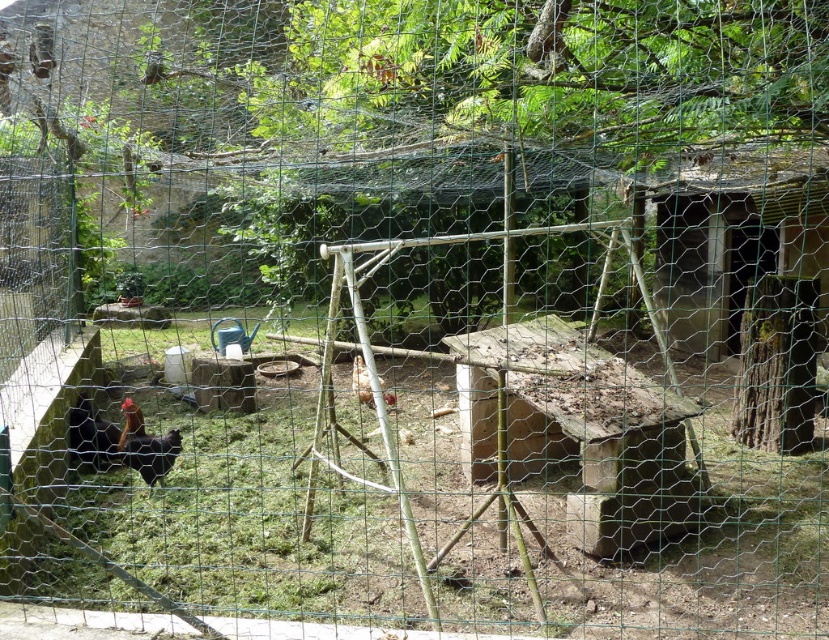
Can you confirm if black matte chicken at lower left is positioned to the right of brown matte chicken at center?

In fact, black matte chicken at lower left is to the left of brown matte chicken at center.

Where is `black matte chicken at lower left`? The width and height of the screenshot is (829, 640). black matte chicken at lower left is located at coordinates (146, 445).

Where is `black matte chicken at lower left`? This screenshot has width=829, height=640. black matte chicken at lower left is located at coordinates (146, 445).